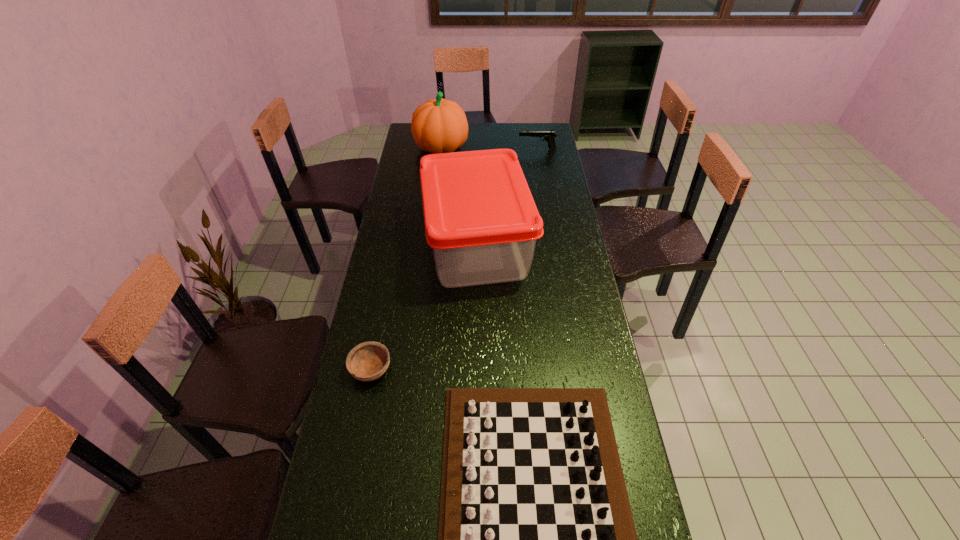
Image resolution: width=960 pixels, height=540 pixels. I want to click on vacant space located 0.310m on the front of the shortest object, so click(x=345, y=501).

Locate an element on the screen. The width and height of the screenshot is (960, 540). object present at the far edge is located at coordinates (438, 126).

I want to click on pumpkin positioned at the left edge, so click(438, 126).

In order to click on tray located in the left edge section of the desktop in this screenshot , I will do `click(481, 221)`.

At what (x,y) coordinates should I click in order to perform the action: click on bowl that is at the left edge. Please return your answer as a coordinate pair (x, y). The height and width of the screenshot is (540, 960). Looking at the image, I should click on (368, 361).

Identify the location of object present at the right edge. The width and height of the screenshot is (960, 540). (549, 136).

Identify the location of object located at the far left corner. The height and width of the screenshot is (540, 960). (438, 126).

The image size is (960, 540). Find the location of `vacant point at the far edge`. vacant point at the far edge is located at coordinates (474, 139).

At what (x,y) coordinates should I click in order to perform the action: click on vacant region at the left edge of the desktop. Please return your answer as a coordinate pair (x, y). Looking at the image, I should click on (386, 374).

In the image, there is a desktop. Where is `free space at the right edge`? free space at the right edge is located at coordinates (580, 381).